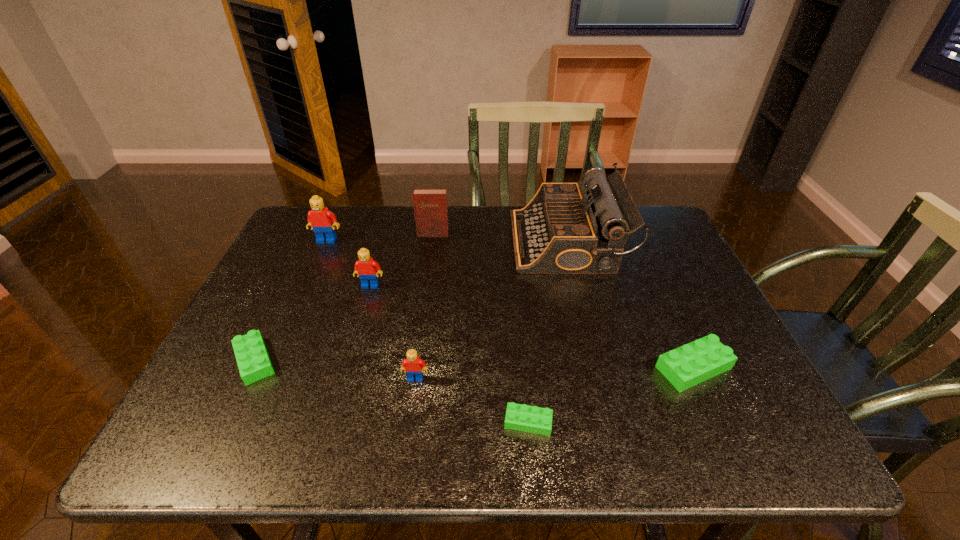
Where is `the tallest object`? This screenshot has width=960, height=540. the tallest object is located at coordinates (563, 230).

This screenshot has width=960, height=540. I want to click on the biggest red Lego, so click(x=322, y=221).

I want to click on the farthest red Lego, so click(322, 221).

Identify the location of reddish-brown diary. The image size is (960, 540). (430, 204).

The height and width of the screenshot is (540, 960). In order to click on the fifth nearest object in this screenshot , I will do `click(367, 269)`.

Where is `the second smallest red Lego`? the second smallest red Lego is located at coordinates (367, 269).

The image size is (960, 540). In order to click on the rightmost red Lego in this screenshot , I will do `click(414, 367)`.

The image size is (960, 540). I want to click on the nearest red Lego, so click(x=414, y=367).

I want to click on the third shortest object, so click(x=684, y=367).

Where is `the rightmost Lego`? the rightmost Lego is located at coordinates (684, 367).